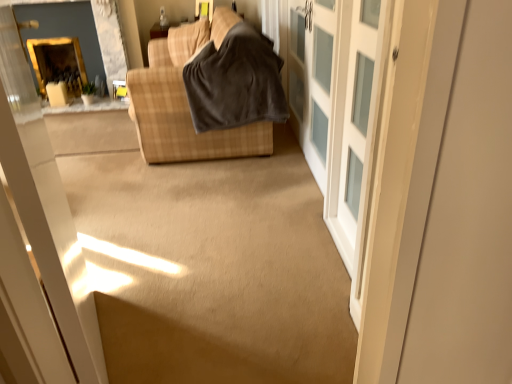
Question: Can you confirm if white frosted glass barn door at center is shorter than white frosted glass cabinet at right?

Choices:
 (A) yes
 (B) no

Answer: (B)

Question: Is white frosted glass barn door at center closer to the viewer compared to white frosted glass cabinet at right?

Choices:
 (A) no
 (B) yes

Answer: (B)

Question: Does white frosted glass barn door at center have a smaller size compared to white frosted glass cabinet at right?

Choices:
 (A) no
 (B) yes

Answer: (A)

Question: Is white frosted glass barn door at center surrounding white frosted glass cabinet at right?

Choices:
 (A) yes
 (B) no

Answer: (A)

Question: Does white frosted glass barn door at center have a greater width compared to white frosted glass cabinet at right?

Choices:
 (A) yes
 (B) no

Answer: (A)

Question: From the image's perspective, would you say white frosted glass barn door at center is positioned over white frosted glass cabinet at right?

Choices:
 (A) yes
 (B) no

Answer: (A)

Question: From a real-world perspective, is gold-framed mirror at upper left physically above dark gray fleece blanket at center?

Choices:
 (A) yes
 (B) no

Answer: (B)

Question: Can you confirm if gold-framed mirror at upper left is bigger than dark gray fleece blanket at center?

Choices:
 (A) no
 (B) yes

Answer: (A)

Question: Can you see gold-framed mirror at upper left touching dark gray fleece blanket at center?

Choices:
 (A) yes
 (B) no

Answer: (B)

Question: Is gold-framed mirror at upper left positioned with its back to dark gray fleece blanket at center?

Choices:
 (A) yes
 (B) no

Answer: (B)

Question: From the image's perspective, does gold-framed mirror at upper left appear lower than dark gray fleece blanket at center?

Choices:
 (A) yes
 (B) no

Answer: (B)

Question: Is there a large distance between gold-framed mirror at upper left and dark gray fleece blanket at center?

Choices:
 (A) yes
 (B) no

Answer: (A)

Question: Is matte yellow window at upper center placed right next to dark gray fleece blanket at center?

Choices:
 (A) no
 (B) yes

Answer: (A)